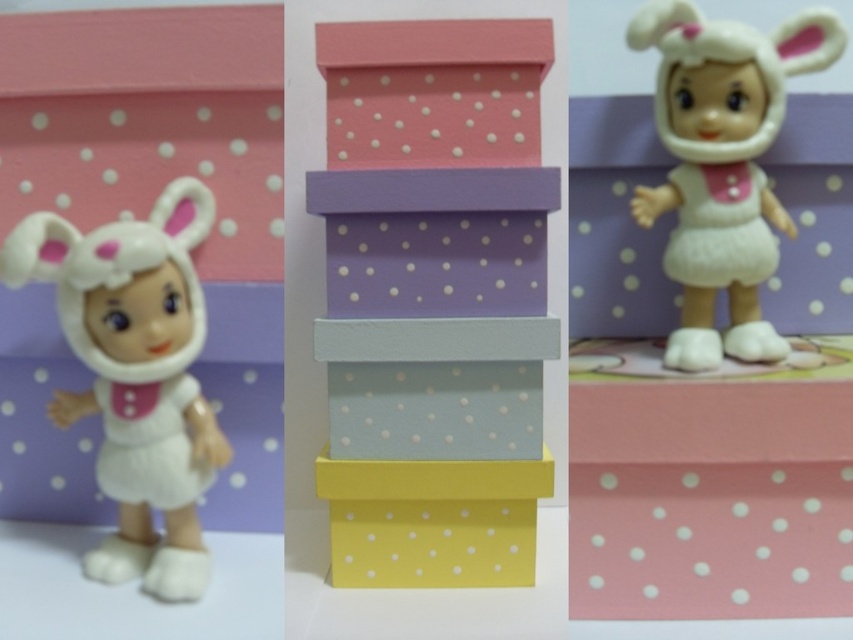
Question: Does pastel polka dot boxes at center come in front of pink matte box at lower right?

Choices:
 (A) no
 (B) yes

Answer: (A)

Question: Can you confirm if white plush toy at left is bigger than matte pink box at center?

Choices:
 (A) no
 (B) yes

Answer: (B)

Question: Which of the following is the farthest from the observer?

Choices:
 (A) pink matte box at lower right
 (B) matte pink box at center

Answer: (B)

Question: Does pastel polka dot boxes at center appear under pink matte box at lower right?

Choices:
 (A) yes
 (B) no

Answer: (B)

Question: Which point appears closest to the camera in this image?

Choices:
 (A) (659, 3)
 (B) (50, 250)
 (C) (718, 550)

Answer: (C)

Question: Based on their relative distances, which object is farther from the white plush doll at upper right?

Choices:
 (A) white plush toy at left
 (B) yellow matte box at center
 (C) pastel polka dot boxes at center
 (D) matte pink box at center

Answer: (A)